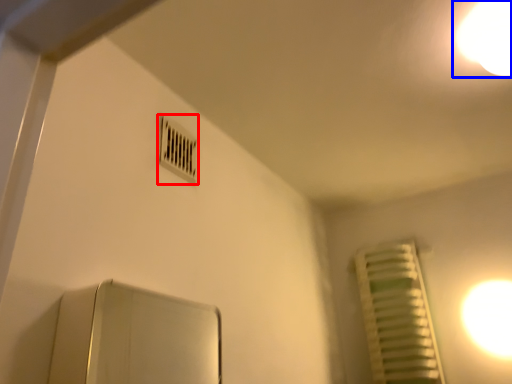
Question: Which object appears farthest to the camera in this image, air conditioning (highlighted by a red box) or light (highlighted by a blue box)?

Choices:
 (A) air conditioning
 (B) light

Answer: (A)